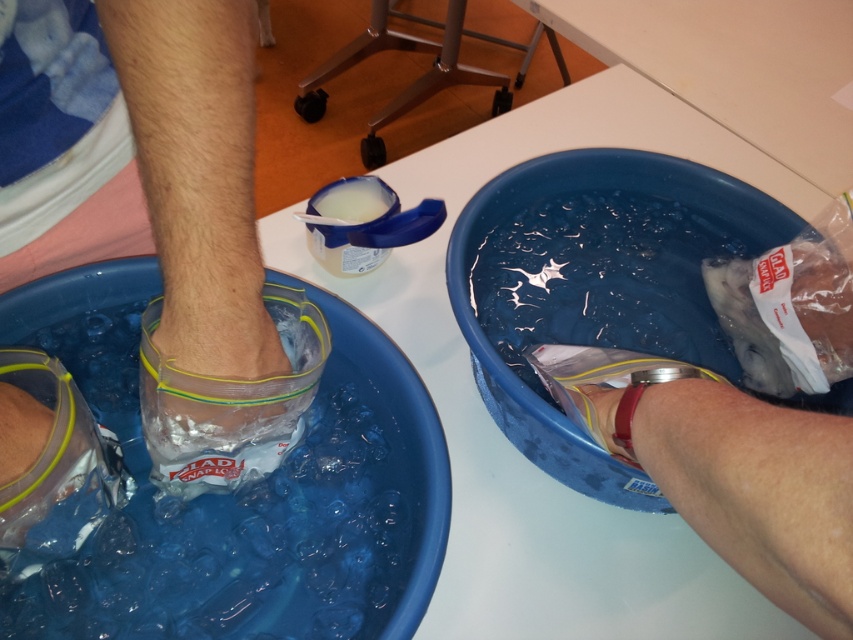
Can you confirm if blue plastic basin at center is smaller than clear plastic bag at lower left?

Incorrect, blue plastic basin at center is not smaller in size than clear plastic bag at lower left.

Between blue plastic basin at center and clear plastic bag at lower left, which one has less height?

With less height is clear plastic bag at lower left.

Between point (635, 275) and point (221, 403), which one is positioned in front?

Point (221, 403)

Find the location of `blue plastic basin at center`. blue plastic basin at center is located at coordinates (596, 285).

What do you see at coordinates (749, 486) in the screenshot? The height and width of the screenshot is (640, 853). I see `smooth white arm at lower right` at bounding box center [749, 486].

Between point (677, 394) and point (219, 387), which one is positioned behind?

Positioned behind is point (219, 387).

Locate an element on the screen. This screenshot has height=640, width=853. smooth white arm at lower right is located at coordinates (749, 486).

Is translucent plastic basin at lower left taller than smooth white arm at lower right?

Yes, translucent plastic basin at lower left is taller than smooth white arm at lower right.

Who is more forward, (402, 362) or (834, 612)?

Point (834, 612) is more forward.

Does point (386, 401) lie in front of point (628, 448)?

No, (386, 401) is behind (628, 448).

The image size is (853, 640). Identify the location of translucent plastic basin at lower left. (242, 490).